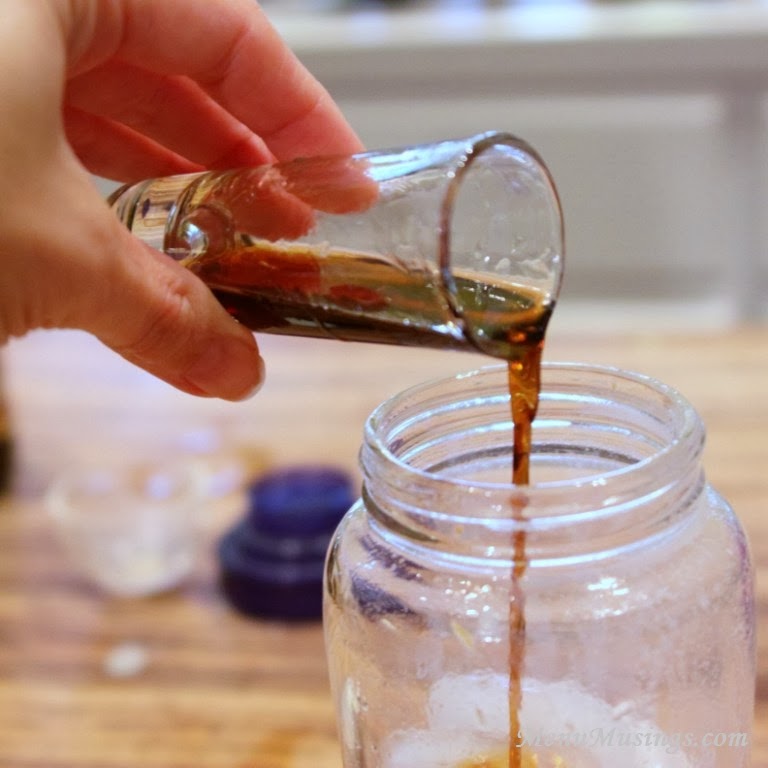
What are the coordinates of `table` in the screenshot? It's located at (159, 716).